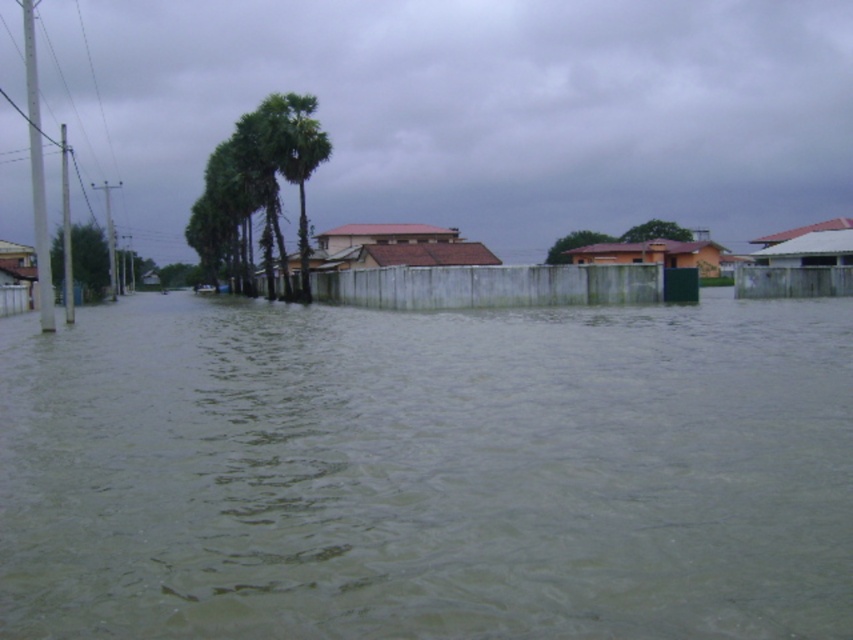
Looking at this image, you are a photographer standing on the flooded street. You want to take a photo that includes both the greenish murky water at center and the green leafy palm trees at center. Which object should you focus on first to ensure both are in sharp focus?

You should focus on the green leafy palm trees at center first because they are farther away from the viewer than the greenish murky water at center. By focusing on the farther object, the closer object will also be in focus due to the depth of field.

Based on the scene, if you were to stand on the flooded street, which object would you see taller from your eye level? The greenish murky water at center or the green leafy palm trees at center?

The green leafy palm trees at center are taller than the greenish murky water at center, so you would see the green leafy palm trees at center taller from your eye level.

Based on the scene description, if you were standing on the flooded street, which object would you encounter first as you move from the left towards the center of the image? The greenish murky water at center or the green leafy palm trees at center?

The green leafy palm trees at center are to the left of the greenish murky water at center, so you would encounter the green leafy palm trees at center first as you move from the left towards the center of the image.